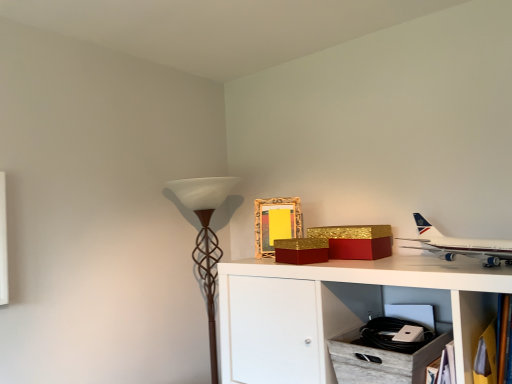
Question: Are gold textured box at upper center, the 2th box in the left-to-right sequence, and white glossy airplane at upper right making contact?

Choices:
 (A) yes
 (B) no

Answer: (B)

Question: From a real-world perspective, is gold textured box at upper center, the 2th box in the left-to-right sequence, physically above white glossy airplane at upper right?

Choices:
 (A) yes
 (B) no

Answer: (B)

Question: Is gold textured box at upper center, which is the 1th box from right to left, located outside white glossy airplane at upper right?

Choices:
 (A) yes
 (B) no

Answer: (A)

Question: Is gold textured box at upper center, the 2th box in the left-to-right sequence, turned away from white glossy airplane at upper right?

Choices:
 (A) no
 (B) yes

Answer: (A)

Question: Considering the relative sizes of gold textured box at upper center, the 2th box in the left-to-right sequence, and white glossy airplane at upper right in the image provided, is gold textured box at upper center, the 2th box in the left-to-right sequence, smaller than white glossy airplane at upper right?

Choices:
 (A) yes
 (B) no

Answer: (A)

Question: Considering the positions of gold textured box at upper center, the 2th box in the left-to-right sequence, and wooden bookshelf at lower right in the image, is gold textured box at upper center, the 2th box in the left-to-right sequence, wider or thinner than wooden bookshelf at lower right?

Choices:
 (A) thin
 (B) wide

Answer: (B)

Question: Is gold textured box at upper center, which is the 1th box from right to left, taller or shorter than wooden bookshelf at lower right?

Choices:
 (A) short
 (B) tall

Answer: (A)

Question: Is gold textured box at upper center, the 2th box in the left-to-right sequence, spatially inside wooden bookshelf at lower right, or outside of it?

Choices:
 (A) outside
 (B) inside

Answer: (A)

Question: Considering the relative positions of gold textured box at upper center, the 2th box in the left-to-right sequence, and wooden bookshelf at lower right in the image provided, is gold textured box at upper center, the 2th box in the left-to-right sequence, to the left or to the right of wooden bookshelf at lower right?

Choices:
 (A) left
 (B) right

Answer: (A)

Question: Visually, is wooden bookshelf at lower right positioned to the left or to the right of gold textured picture frame at upper center?

Choices:
 (A) left
 (B) right

Answer: (B)

Question: Is wooden bookshelf at lower right inside the boundaries of gold textured picture frame at upper center, or outside?

Choices:
 (A) inside
 (B) outside

Answer: (B)

Question: In terms of width, does wooden bookshelf at lower right look wider or thinner when compared to gold textured picture frame at upper center?

Choices:
 (A) thin
 (B) wide

Answer: (B)

Question: Does point (477, 337) appear closer or farther from the camera than point (268, 236)?

Choices:
 (A) farther
 (B) closer

Answer: (B)

Question: Is gold textured box at upper center, which is the 1th box from right to left, situated inside brown textured floor lamp at left or outside?

Choices:
 (A) inside
 (B) outside

Answer: (B)

Question: In terms of size, does gold textured box at upper center, which is the 1th box from right to left, appear bigger or smaller than brown textured floor lamp at left?

Choices:
 (A) big
 (B) small

Answer: (B)